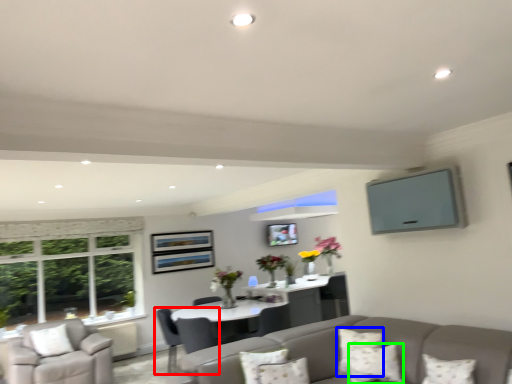
Question: Based on their relative distances, which object is farther from chair (highlighted by a red box)? Choose from pillow (highlighted by a blue box) and pillow (highlighted by a green box).

Choices:
 (A) pillow
 (B) pillow

Answer: (B)